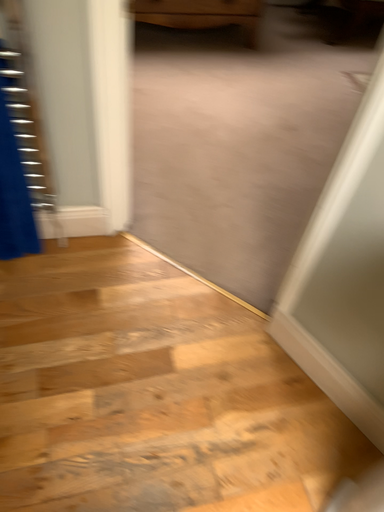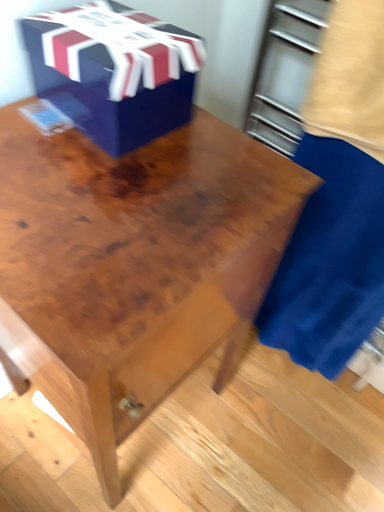
Question: Which way did the camera rotate in the video?

Choices:
 (A) rotated right
 (B) rotated left

Answer: (B)